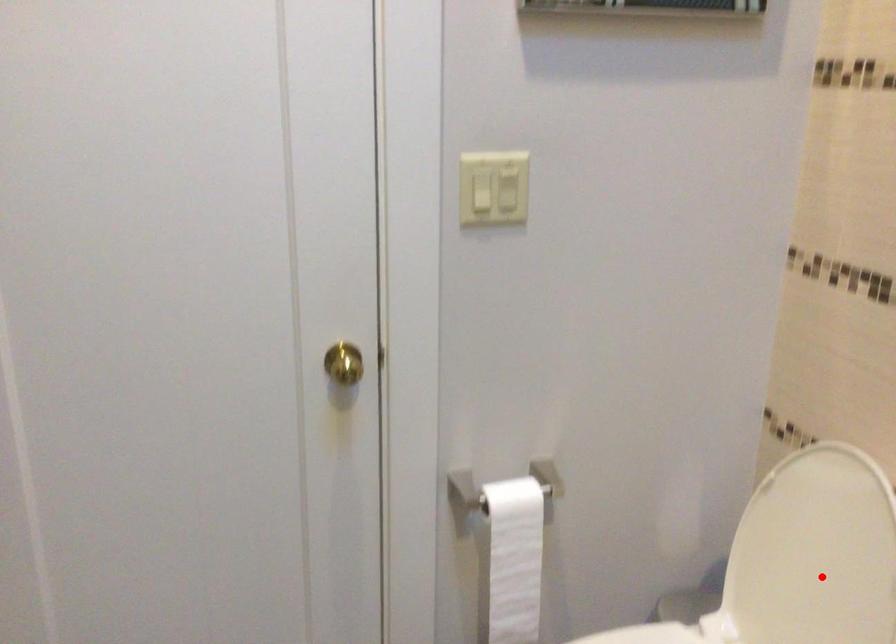
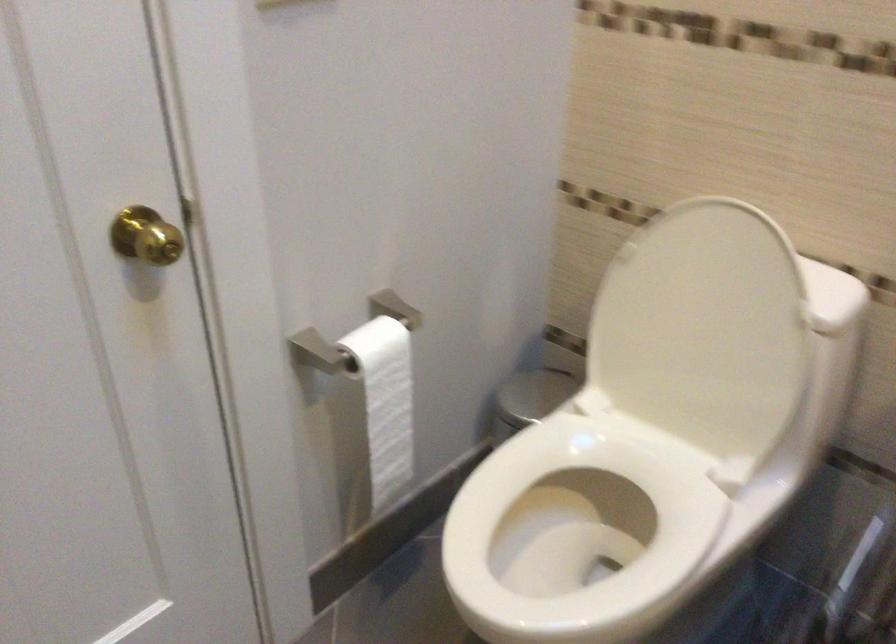
In the second image, find the point that corresponds to the highlighted location in the first image.

(702, 330)